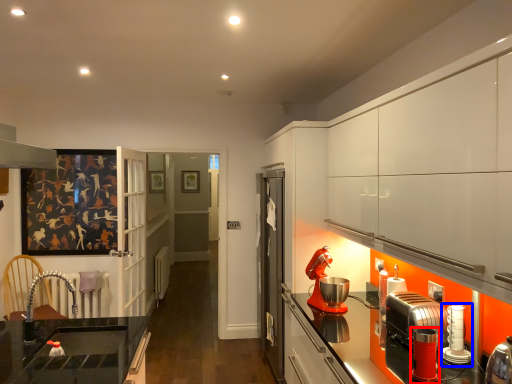
Question: Which object is closer to the camera taking this photo, kitchen appliance (highlighted by a red box) or kitchen appliance (highlighted by a blue box)?

Choices:
 (A) kitchen appliance
 (B) kitchen appliance

Answer: (A)